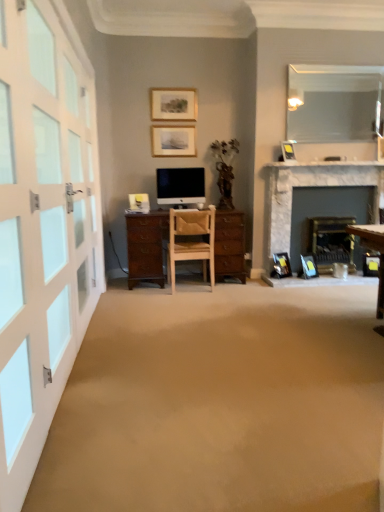
What are the coordinates of `blank space situated above clear glass mirror at upper right (from a real-world perspective)` in the screenshot? It's located at (342, 58).